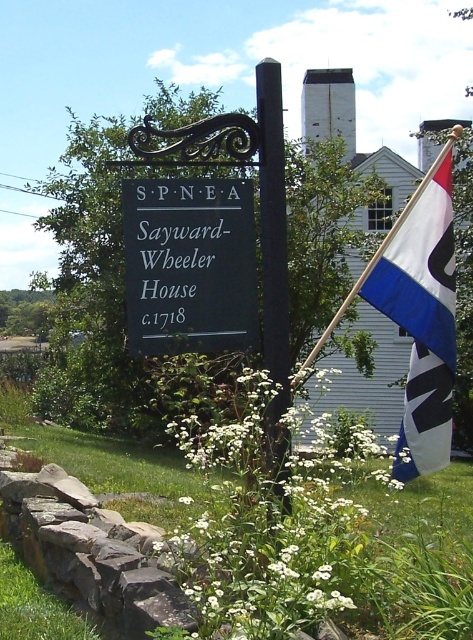
Is white fluffy flowers at center bigger than black matte sign at center?

Correct, white fluffy flowers at center is larger in size than black matte sign at center.

Who is positioned more to the right, white fluffy flowers at center or black matte sign at center?

Positioned to the right is white fluffy flowers at center.

Locate an element on the screen. The width and height of the screenshot is (473, 640). white fluffy flowers at center is located at coordinates (270, 524).

The height and width of the screenshot is (640, 473). What are the coordinates of `white fluffy flowers at center` in the screenshot? It's located at (270, 524).

Consider the image. Is black matte sign at center below blue and white fabric flag at right?

Actually, black matte sign at center is above blue and white fabric flag at right.

Does black matte sign at center lie behind blue and white fabric flag at right?

Yes, it is behind blue and white fabric flag at right.

At what (x,y) coordinates should I click in order to perform the action: click on black matte sign at center. Please return your answer as a coordinate pair (x, y). Looking at the image, I should click on (190, 264).

Where is `black matte sign at center`? The image size is (473, 640). black matte sign at center is located at coordinates (190, 264).

Image resolution: width=473 pixels, height=640 pixels. In order to click on white fluffy flowers at center in this screenshot , I will do `click(270, 524)`.

Between white fluffy flowers at center and blue and white fabric flag at right, which one has less height?

white fluffy flowers at center

What are the coordinates of `white fluffy flowers at center` in the screenshot? It's located at point(270,524).